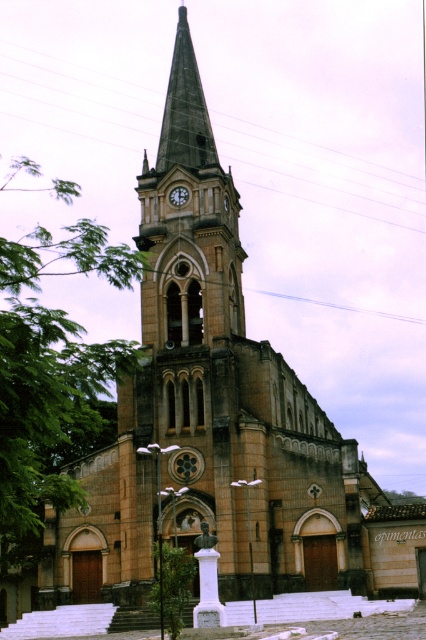
Question: Is green leafy tree at left positioned behind matte stone clock at center?

Choices:
 (A) yes
 (B) no

Answer: (B)

Question: In this image, where is green leafy tree at left located relative to matte stone clock at center?

Choices:
 (A) above
 (B) below

Answer: (B)

Question: Which point is closer to the camera?

Choices:
 (A) matte stone clock at center
 (B) green leafy tree at left

Answer: (B)

Question: Does green leafy tree at left appear on the left side of matte stone clock at center?

Choices:
 (A) yes
 (B) no

Answer: (A)